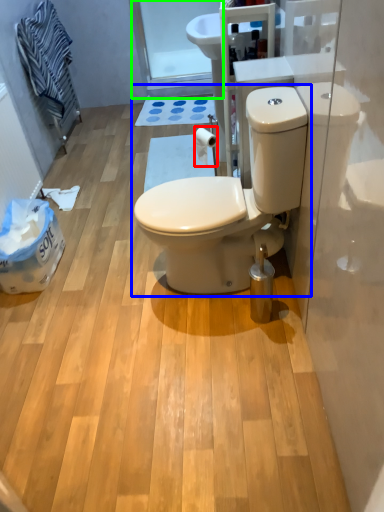
Question: Estimate the real-world distances between objects in this image. Which object is farther from toilet paper (highlighted by a red box), toilet (highlighted by a blue box) or glass door (highlighted by a green box)?

Choices:
 (A) toilet
 (B) glass door

Answer: (B)